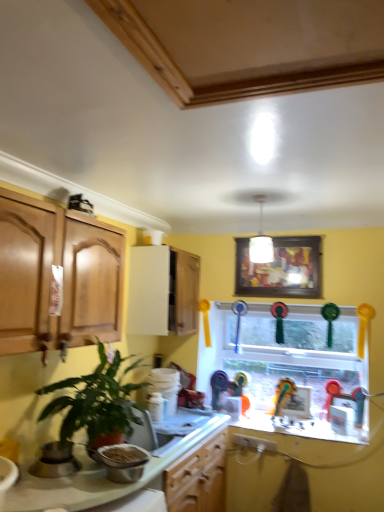
What are the coordinates of `free space above wooden framed picture at upper center (from a real-world perspective)` in the screenshot? It's located at (278, 237).